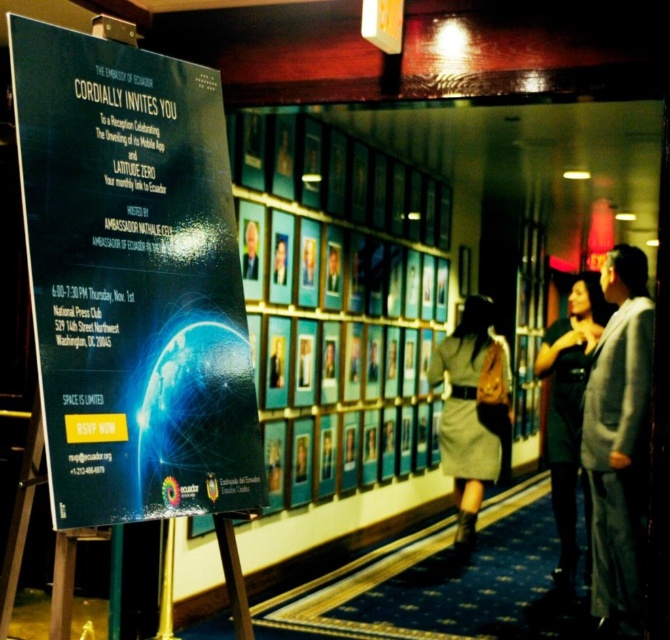
You are a guest at the event and want to read the text on the matte black poster at center. You notice a light brown fabric skirt at center is partially blocking your view. Can you determine if the poster is wide enough to read around the skirt?

The matte black poster at center is wider than the light brown fabric skirt at center, so you can read around the skirt by moving to the sides where the poster extends beyond the skirt.

You are at the embassy event and see the gray wool coat at right and the light brown fabric skirt at center. Which item is positioned more to the right side of the scene?

The gray wool coat at right is positioned more to the right side of the scene compared to the light brown fabric skirt at center.